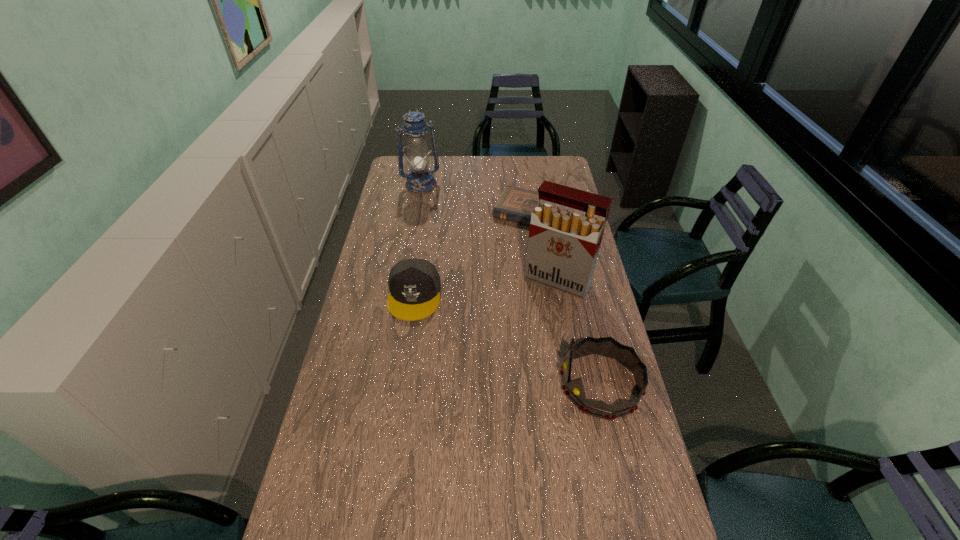
Find the location of a particular element. free space at the right edge of the desktop is located at coordinates (617, 367).

Image resolution: width=960 pixels, height=540 pixels. In the image, there is a desktop. What are the coordinates of `free region at the far right corner` in the screenshot? It's located at (556, 158).

Locate an element on the screen. The image size is (960, 540). free space at the near right corner is located at coordinates (603, 532).

This screenshot has height=540, width=960. Find the location of `free space between the farthest object and the cigarette case`. free space between the farthest object and the cigarette case is located at coordinates (490, 232).

Find the location of a particular element. This screenshot has height=540, width=960. vacant area that lies between the farthest object and the nearest object is located at coordinates (511, 285).

Image resolution: width=960 pixels, height=540 pixels. I want to click on unoccupied position between the third tallest object and the Bible, so click(x=566, y=299).

The image size is (960, 540). I want to click on free space between the cap and the cigarette case, so click(487, 288).

Where is `vacant point located between the third tallest object and the second shortest object`? vacant point located between the third tallest object and the second shortest object is located at coordinates 507,340.

The width and height of the screenshot is (960, 540). In order to click on free space between the nearest object and the cigarette case in this screenshot , I will do `click(580, 333)`.

In order to click on empty space that is in between the second farthest object and the cap in this screenshot , I will do `click(473, 254)`.